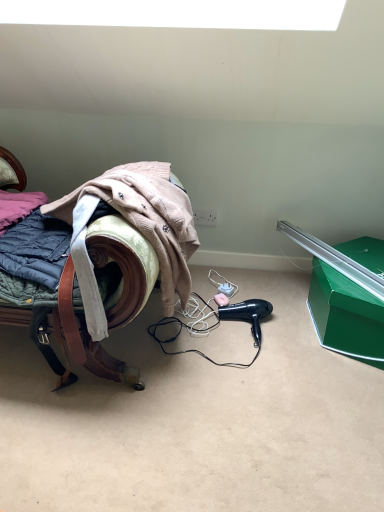
Question: Considering the relative positions of green cardboard box at lower right and black plastic hair dryer at lower center in the image provided, is green cardboard box at lower right to the right of black plastic hair dryer at lower center from the viewer's perspective?

Choices:
 (A) no
 (B) yes

Answer: (B)

Question: Would you consider green cardboard box at lower right to be distant from black plastic hair dryer at lower center?

Choices:
 (A) no
 (B) yes

Answer: (A)

Question: Does green cardboard box at lower right have a greater width compared to black plastic hair dryer at lower center?

Choices:
 (A) no
 (B) yes

Answer: (B)

Question: Are green cardboard box at lower right and black plastic hair dryer at lower center beside each other?

Choices:
 (A) no
 (B) yes

Answer: (A)

Question: From a real-world perspective, is green cardboard box at lower right beneath black plastic hair dryer at lower center?

Choices:
 (A) no
 (B) yes

Answer: (A)

Question: Considering the positions of black plastic hair dryer at lower center and green cardboard box at lower right in the image, is black plastic hair dryer at lower center taller or shorter than green cardboard box at lower right?

Choices:
 (A) tall
 (B) short

Answer: (B)

Question: From a real-world perspective, is black plastic hair dryer at lower center above or below green cardboard box at lower right?

Choices:
 (A) below
 (B) above

Answer: (A)

Question: Is black plastic hair dryer at lower center wider or thinner than green cardboard box at lower right?

Choices:
 (A) wide
 (B) thin

Answer: (B)

Question: Is point (256, 331) positioned closer to the camera than point (342, 276)?

Choices:
 (A) closer
 (B) farther

Answer: (B)

Question: Would you say velvet green suitcase at left is inside or outside black plastic hair dryer at lower center?

Choices:
 (A) outside
 (B) inside

Answer: (A)

Question: Looking at their shapes, would you say velvet green suitcase at left is wider or thinner than black plastic hair dryer at lower center?

Choices:
 (A) thin
 (B) wide

Answer: (B)

Question: From the image's perspective, is velvet green suitcase at left located above or below black plastic hair dryer at lower center?

Choices:
 (A) below
 (B) above

Answer: (B)

Question: Is velvet green suitcase at left bigger or smaller than black plastic hair dryer at lower center?

Choices:
 (A) big
 (B) small

Answer: (A)

Question: From the image's perspective, relative to velvet green suitcase at left, is green cardboard box at lower right above or below?

Choices:
 (A) above
 (B) below

Answer: (B)

Question: From a real-world perspective, is green cardboard box at lower right positioned above or below velvet green suitcase at left?

Choices:
 (A) above
 (B) below

Answer: (B)